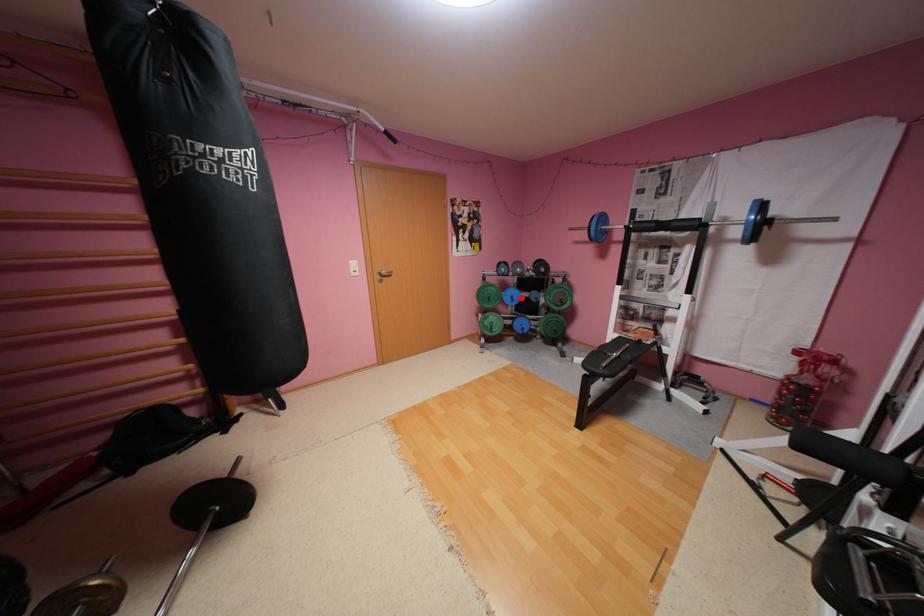
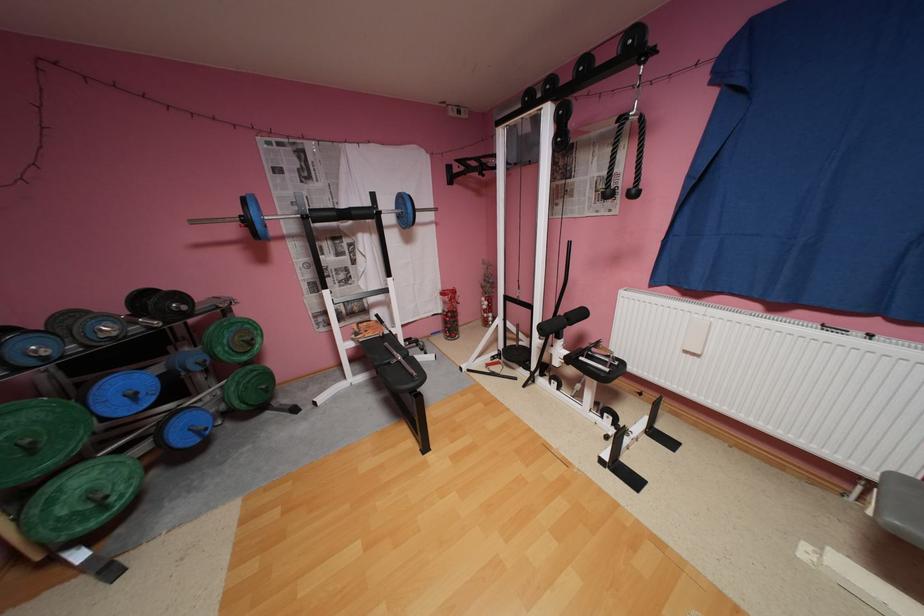
Locate, in the second image, the point that corresponds to the highlighted location in the first image.

(142, 395)